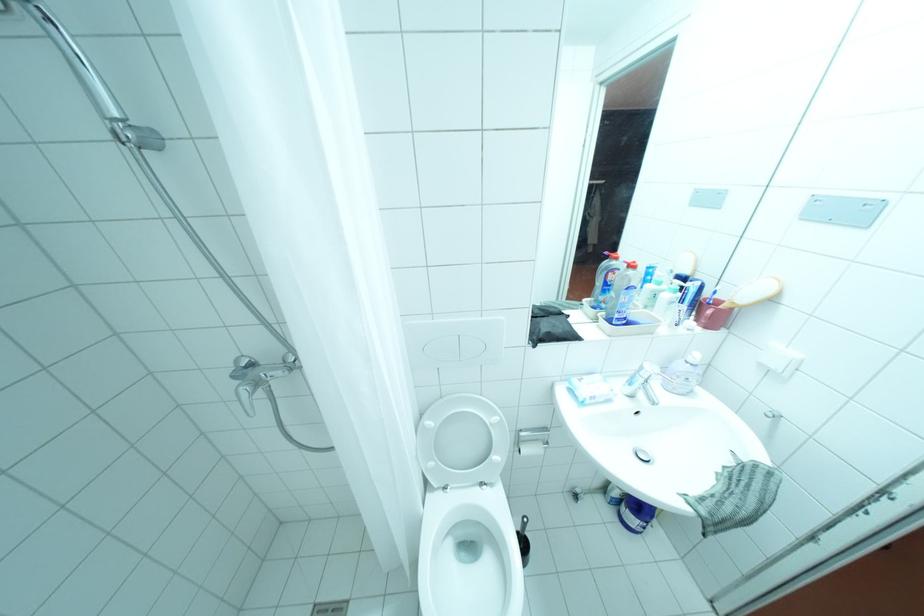
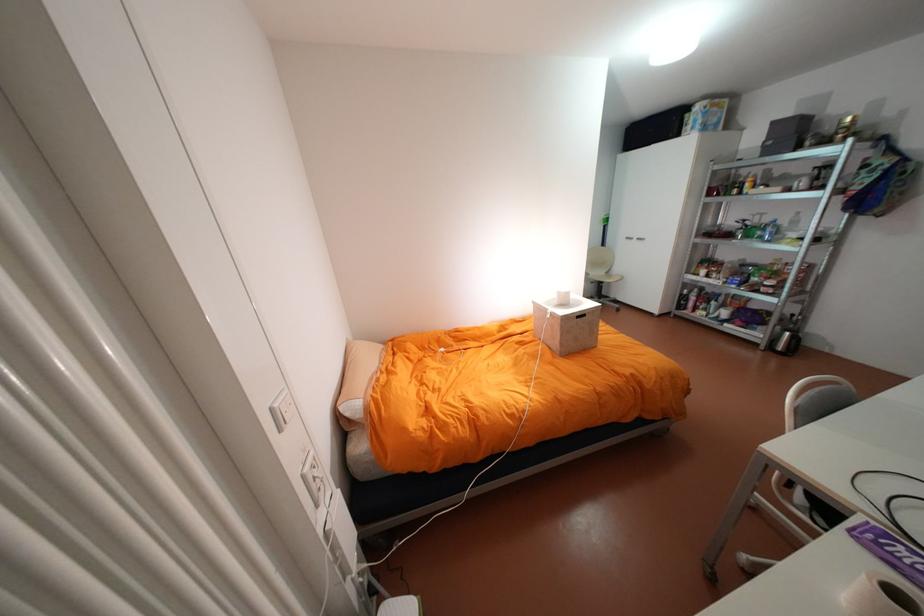
Question: I am providing you with two images of the same scene from different viewpoints. Please identify which objects are invisible in image2.

Choices:
 (A) toothpaste tube
 (B) blue trackball mouse
 (C) white light switch
 (D) clear plastic bottle

Answer: (A)